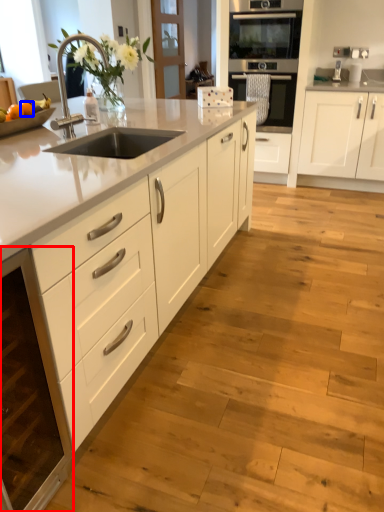
Question: Which object appears farthest to the camera in this image, cabinetry (highlighted by a red box) or orange (highlighted by a blue box)?

Choices:
 (A) cabinetry
 (B) orange

Answer: (B)